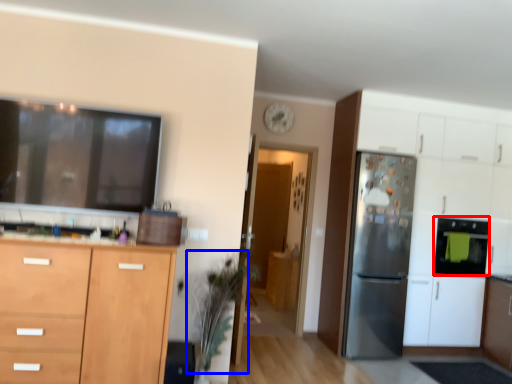
Question: Which of the following is the closest to the observer, appliance (highlighted by a red box) or plant (highlighted by a blue box)?

Choices:
 (A) appliance
 (B) plant

Answer: (B)